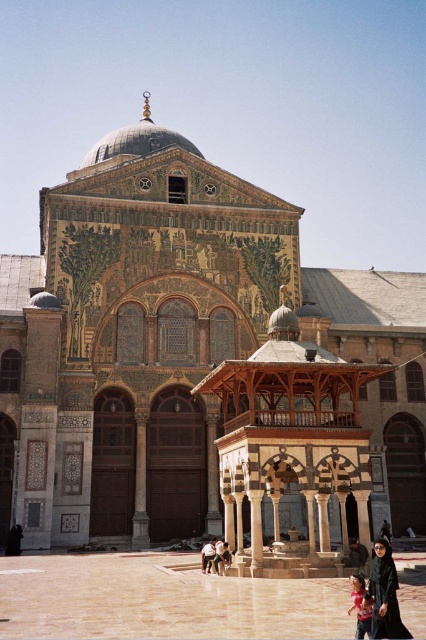
Question: Is black fabric person at lower right to the right of light brown wooden bench at center from the viewer's perspective?

Choices:
 (A) yes
 (B) no

Answer: (A)

Question: Which object appears farthest from the camera in this image?

Choices:
 (A) black fabric person at lower right
 (B) polished stone courtyard at center

Answer: (A)

Question: Can you confirm if wooden pavilion at center is smaller than light brown leather jacket at lower center?

Choices:
 (A) yes
 (B) no

Answer: (B)

Question: Among these objects, which one is farthest from the camera?

Choices:
 (A) mosaic tile church at center
 (B) light brown wooden bench at center
 (C) wooden pavilion at center
 (D) matte black dress at lower right

Answer: (A)

Question: Is mosaic tile church at center below light brown wooden bench at center?

Choices:
 (A) no
 (B) yes

Answer: (A)

Question: Which of the following is the closest to the observer?

Choices:
 (A) light brown leather jacket at lower center
 (B) matte black dress at lower right
 (C) black fabric person at lower right

Answer: (C)